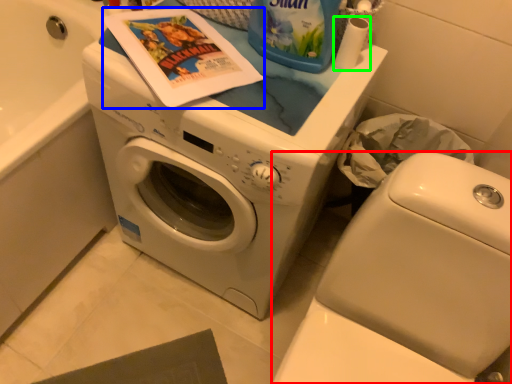
Question: Based on their relative distances, which object is farther from washer (highlighted by a red box)? Choose from comic book (highlighted by a blue box) and toilet paper (highlighted by a green box).

Choices:
 (A) comic book
 (B) toilet paper

Answer: (A)